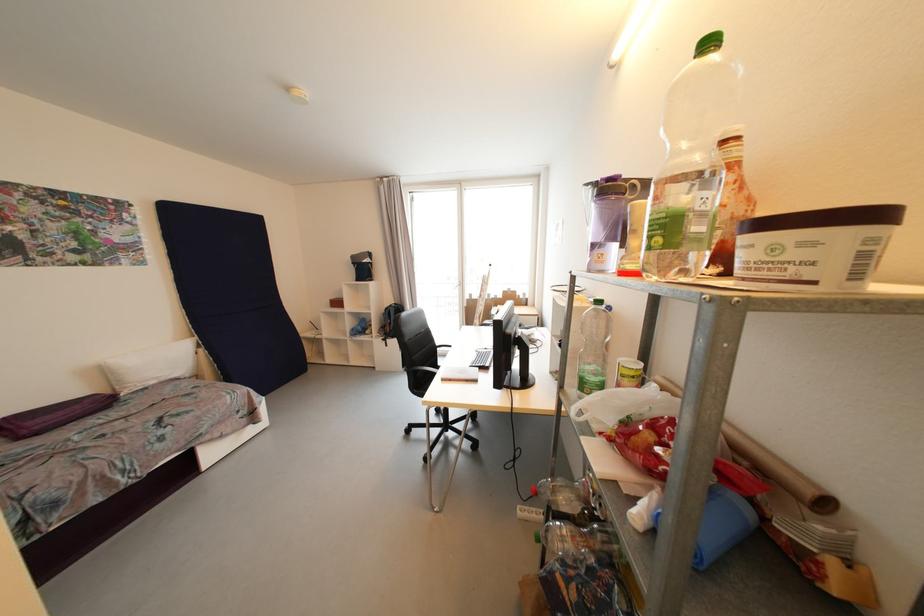
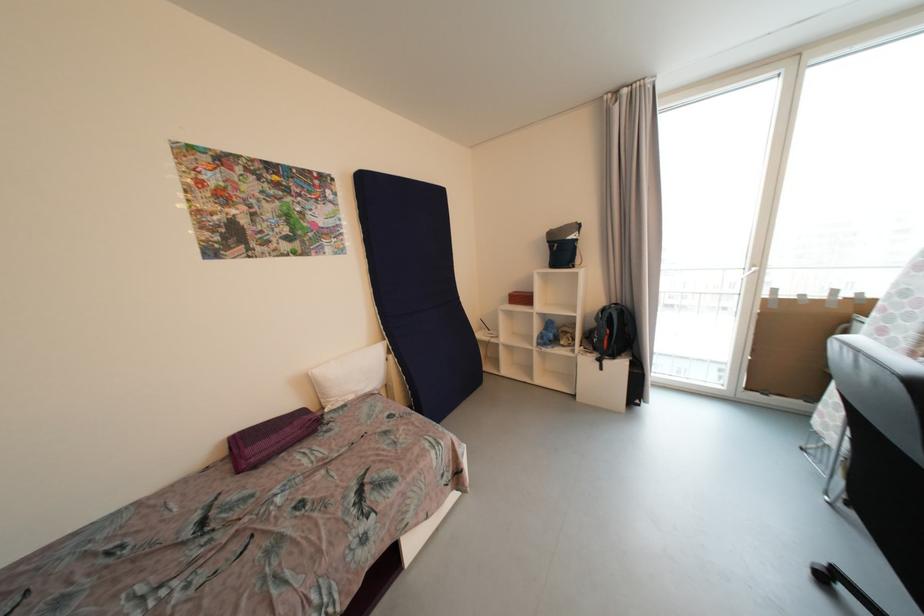
Locate, in the second image, the point that corresponds to the point at 207,352 in the first image.

(396, 359)